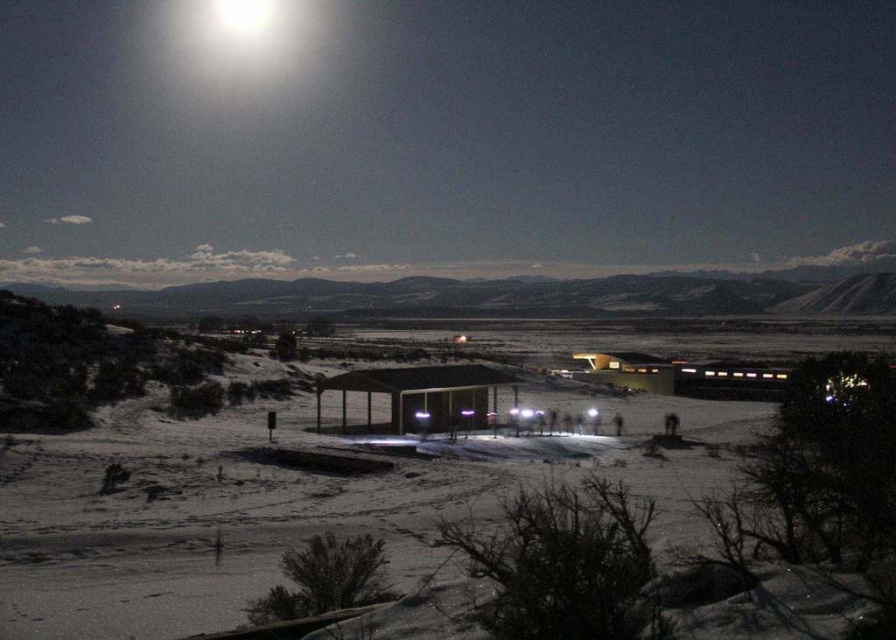
Question: Among these points, which one is nearest to the camera?

Choices:
 (A) (221, 10)
 (B) (450, 419)

Answer: (B)

Question: Can you confirm if bright white sky at upper center is positioned to the right of bright white light at upper center?

Choices:
 (A) no
 (B) yes

Answer: (B)

Question: Based on their relative distances, which object is farther from the matte wood hut at center?

Choices:
 (A) bright white light at upper center
 (B) bright white sky at upper center

Answer: (A)

Question: Estimate the real-world distances between objects in this image. Which object is closer to the bright white sky at upper center?

Choices:
 (A) bright white light at upper center
 (B) matte wood hut at center

Answer: (A)

Question: Does bright white sky at upper center appear over matte wood hut at center?

Choices:
 (A) no
 (B) yes

Answer: (B)

Question: Does bright white sky at upper center have a larger size compared to bright white light at upper center?

Choices:
 (A) yes
 (B) no

Answer: (A)